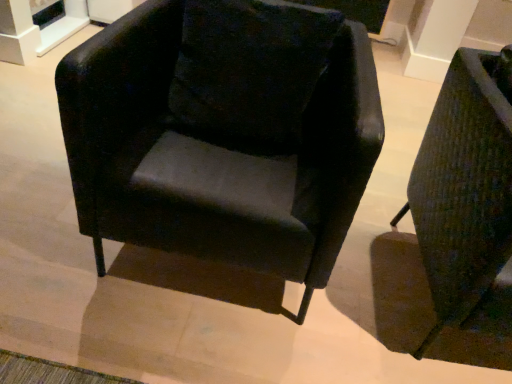
The width and height of the screenshot is (512, 384). Find the location of `free space in front of matte black armchair at center, positioned as the 2th chair in right-to-left order`. free space in front of matte black armchair at center, positioned as the 2th chair in right-to-left order is located at coordinates (168, 340).